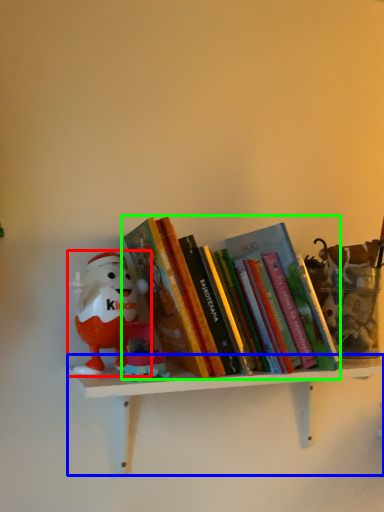
Question: Considering the real-world distances, which object is farthest from toy (highlighted by a red box)? shelf (highlighted by a blue box) or book (highlighted by a green box)?

Choices:
 (A) shelf
 (B) book

Answer: (A)